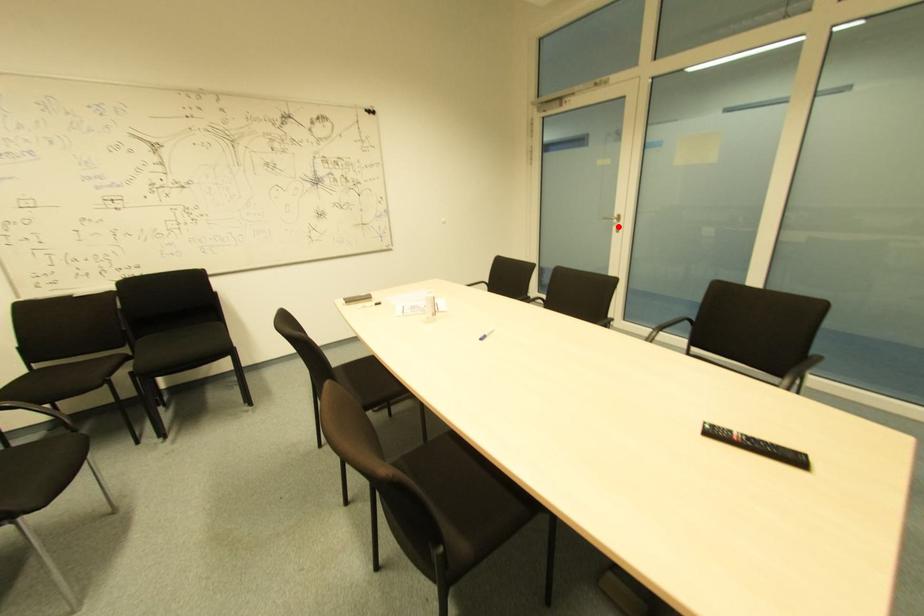
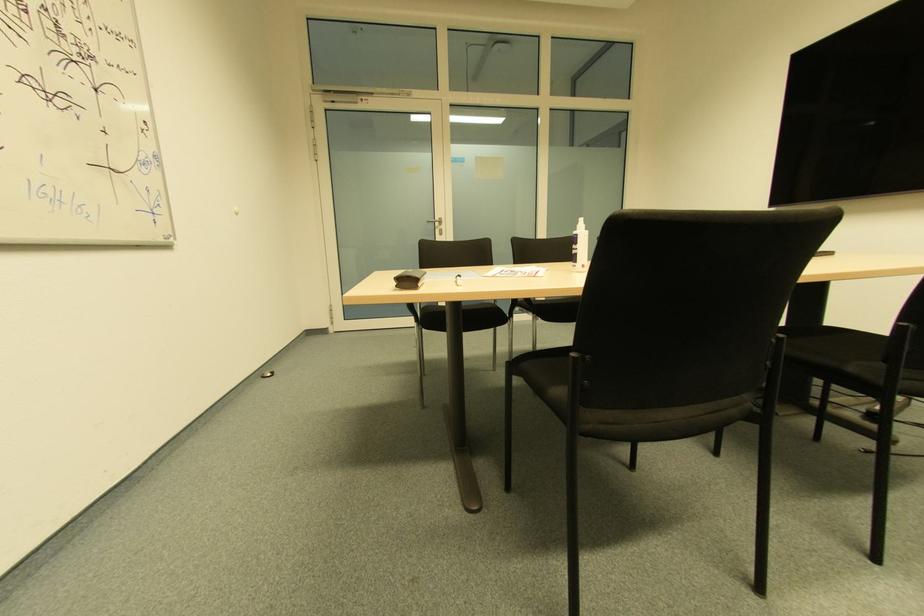
Where in the second image is the point corresponding to the highlighted location from the first image?

(440, 230)